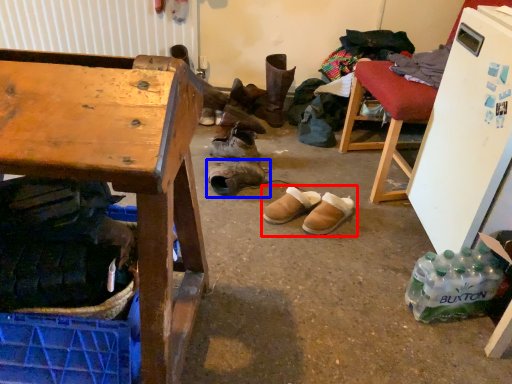
Question: Among these objects, which one is nearest to the camera, footwear (highlighted by a red box) or footwear (highlighted by a blue box)?

Choices:
 (A) footwear
 (B) footwear

Answer: (A)